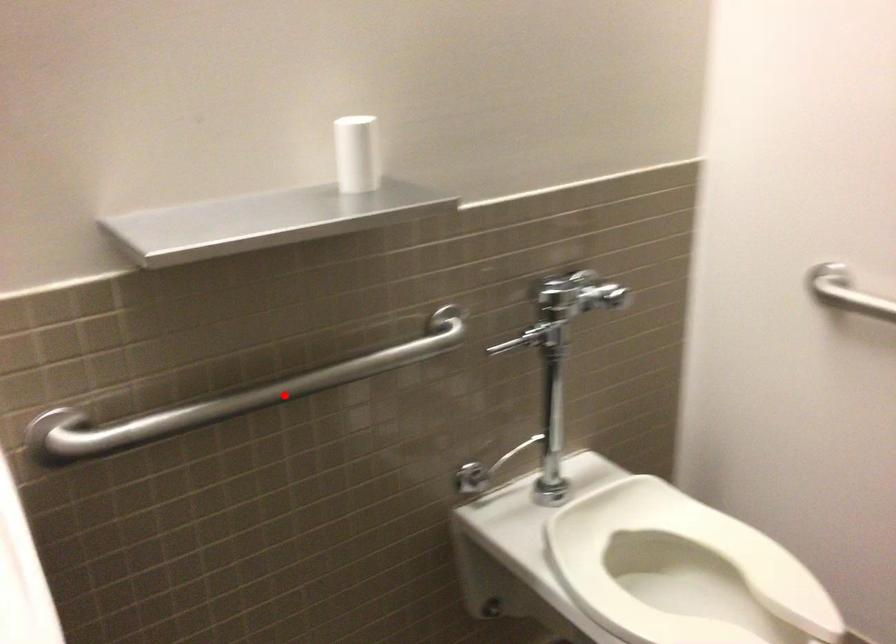
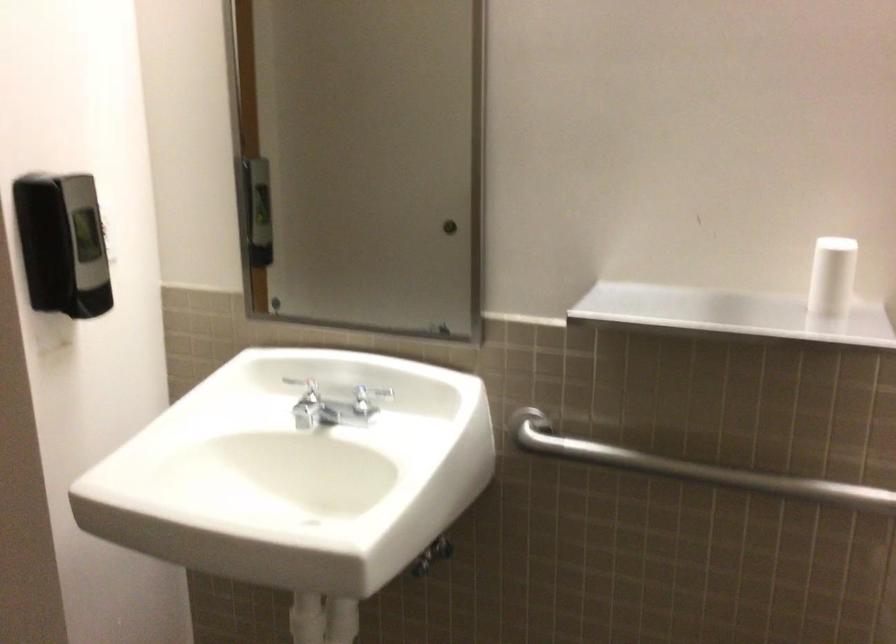
Question: I am providing you with two images of the same scene from different viewpoints. A red point is marked on the first image. Can you still see the location of the red point in image 2?

Choices:
 (A) Yes
 (B) No

Answer: (A)